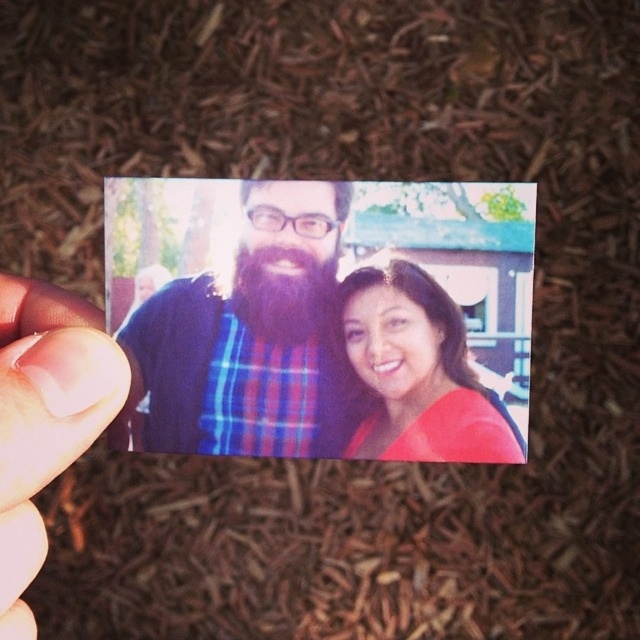
You are a photographer analyzing the composition of this image. The plaid fabric shirt at center and the pale skin at center are both in focus. Which object takes up more space in the photo?

The pale skin at center takes up more space in the photo than the plaid fabric shirt at center, as the plaid fabric shirt at center has a smaller size compared to pale skin at center.

You are a photographer trying to frame a close portrait of the plaid fabric shirt at center and the pale skin at center in the photograph. Can you fit both subjects within a 4 inch wide frame without cropping either of them?

The plaid fabric shirt at center and pale skin at center are 3.49 inches apart from each other. Since the total width required is less than 4 inches, both subjects can fit within the frame without cropping.

Looking at the photograph in the hand, which shirt is positioned to the left between the plaid fabric shirt at center and the matte red shirt at center?

The plaid fabric shirt at center is positioned to the left of the matte red shirt at center.